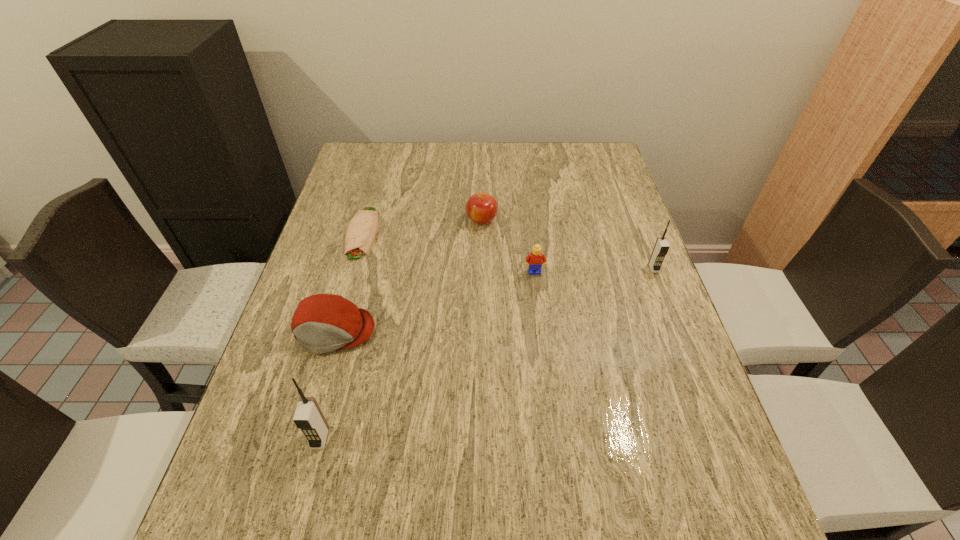
The width and height of the screenshot is (960, 540). Find the location of `vacant point at the left edge`. vacant point at the left edge is located at coordinates (305, 383).

The width and height of the screenshot is (960, 540). What are the coordinates of `vacant space at the right edge of the desktop` in the screenshot? It's located at (600, 192).

The width and height of the screenshot is (960, 540). I want to click on free space at the far left corner of the desktop, so click(x=384, y=151).

In the image, there is a desktop. Identify the location of vacant space at the near left corner. (322, 451).

This screenshot has height=540, width=960. Find the location of `vacant region at the far right corner of the desktop`. vacant region at the far right corner of the desktop is located at coordinates (591, 180).

At what (x,y) coordinates should I click in order to perform the action: click on empty space between the cap and the shorter cellular telephone. Please return your answer as a coordinate pair (x, y). Looking at the image, I should click on (494, 299).

This screenshot has height=540, width=960. What are the coordinates of `free spot between the Lego and the shortest object` in the screenshot? It's located at (x=448, y=252).

At what (x,y) coordinates should I click in order to perform the action: click on vacant area that lies between the burrito and the fourth object from left to right. Please return your answer as a coordinate pair (x, y). Looking at the image, I should click on (422, 226).

Identify the location of free space between the third object from right to left and the fifth object from left to right. (508, 246).

Where is `vacant space that is in between the shortest object and the second object from right to left`? This screenshot has height=540, width=960. vacant space that is in between the shortest object and the second object from right to left is located at coordinates (448, 252).